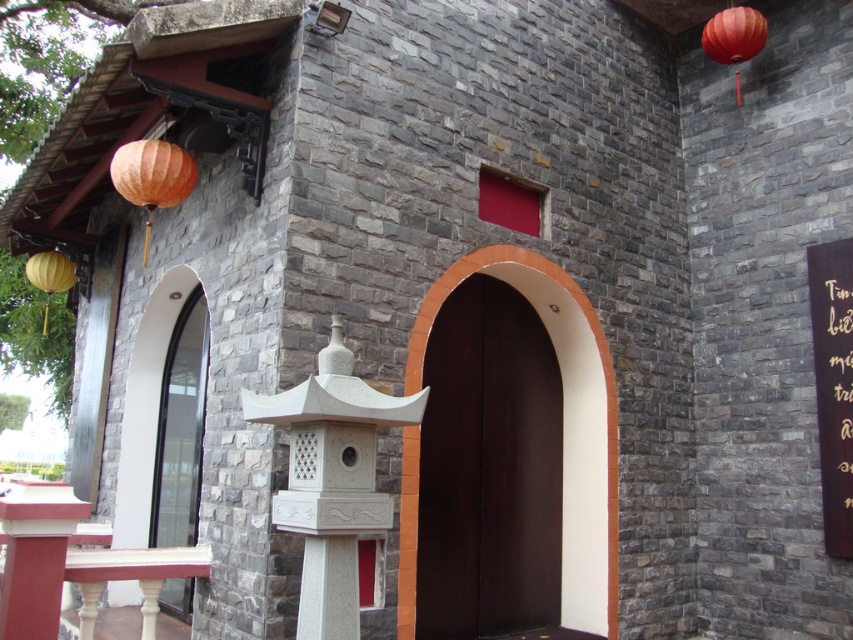
Consider the image. You are a delivery person trying to deliver a package to the building. The package is too large to fit through the doorway. Can you determine which object, the dark wood door at center or the wooden sign at right, is the reason you can not fit through the doorway?

The dark wood door at center has a larger size compared to wooden sign at right, so the dark wood door at center is the reason you cannot fit through the doorway because it is the larger object.

You are standing in front of the building and notice two lanterns. The matte orange lantern at upper right and the matte yellow lantern at left. Which lantern is located to the right of the other?

The matte orange lantern at upper right is positioned on the right side of the matte yellow lantern at left.